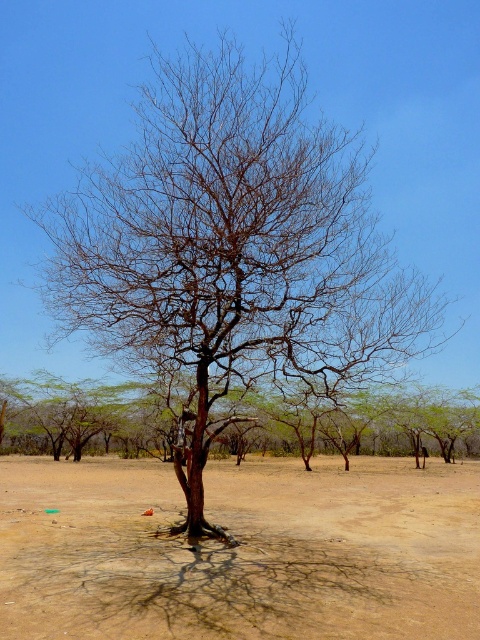
Question: Is brown sandy dirt at center wider than brown bark tree at center?

Choices:
 (A) no
 (B) yes

Answer: (A)

Question: Among these points, which one is nearest to the camera?

Choices:
 (A) (41, 442)
 (B) (148, 634)

Answer: (B)

Question: Is brown sandy dirt at center to the left of brown bark tree at center from the viewer's perspective?

Choices:
 (A) yes
 (B) no

Answer: (B)

Question: Is brown sandy dirt at center positioned in front of brown bark tree at center?

Choices:
 (A) no
 (B) yes

Answer: (B)